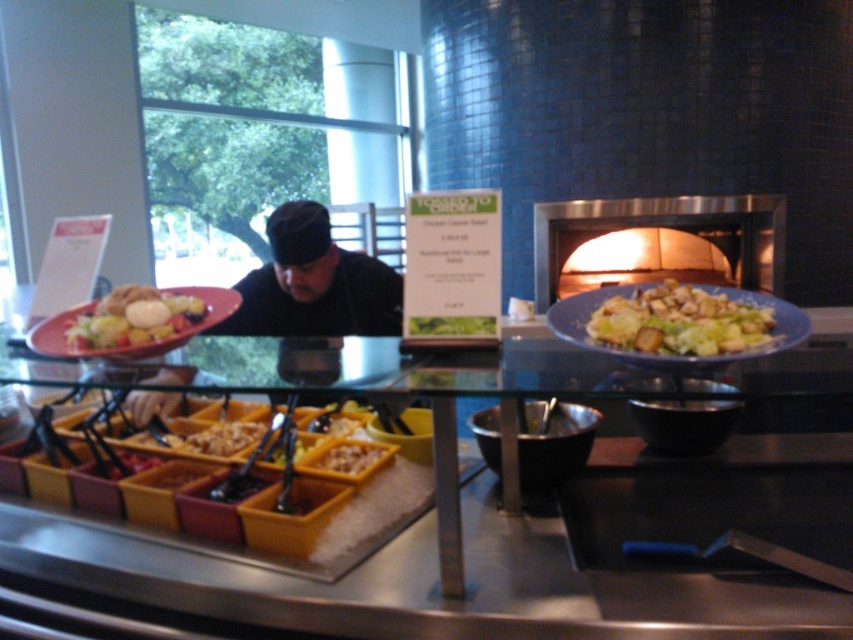
Question: Does black fabric at center come in front of green leafy vegetable at center?

Choices:
 (A) no
 (B) yes

Answer: (A)

Question: Can you confirm if green leafy vegetable at center is wider than yellow plastic tray at center?

Choices:
 (A) no
 (B) yes

Answer: (B)

Question: Does black fabric at center have a greater width compared to matte brown croutons at center?

Choices:
 (A) no
 (B) yes

Answer: (B)

Question: Which point is closer to the camera?

Choices:
 (A) (614, 317)
 (B) (267, 326)

Answer: (A)

Question: Among these objects, which one is nearest to the camera?

Choices:
 (A) stainless steel oven at center
 (B) green leafy vegetable at center

Answer: (B)

Question: Which object is farther from the camera taking this photo?

Choices:
 (A) matte white salad at center
 (B) matte brown croutons at center

Answer: (A)